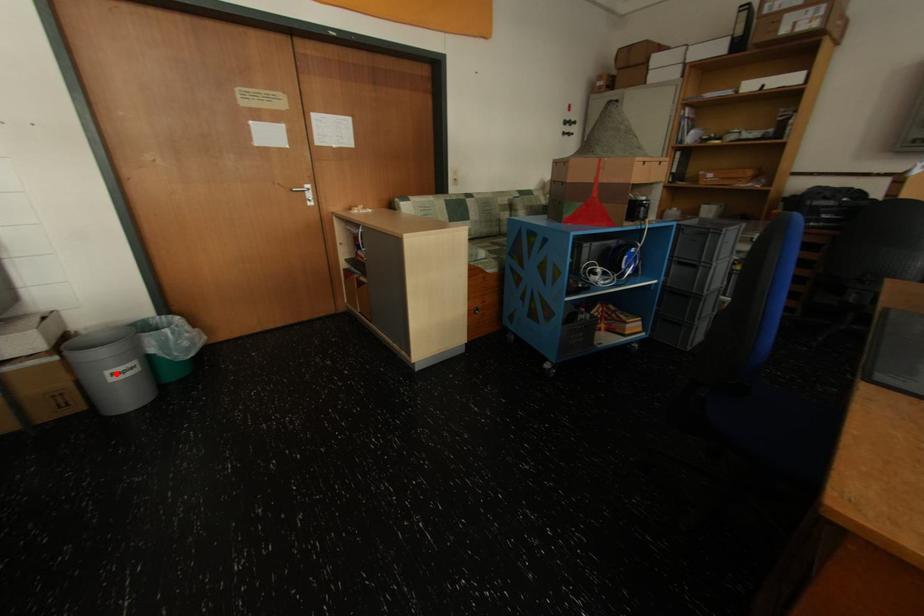
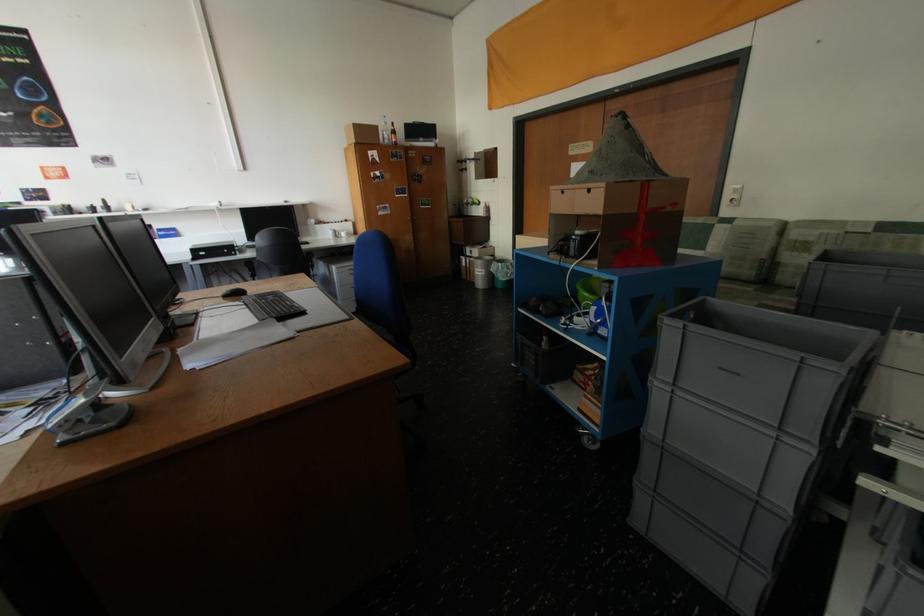
Where in the second image is the point corresponding to the highlighted location from the first image?

(484, 270)